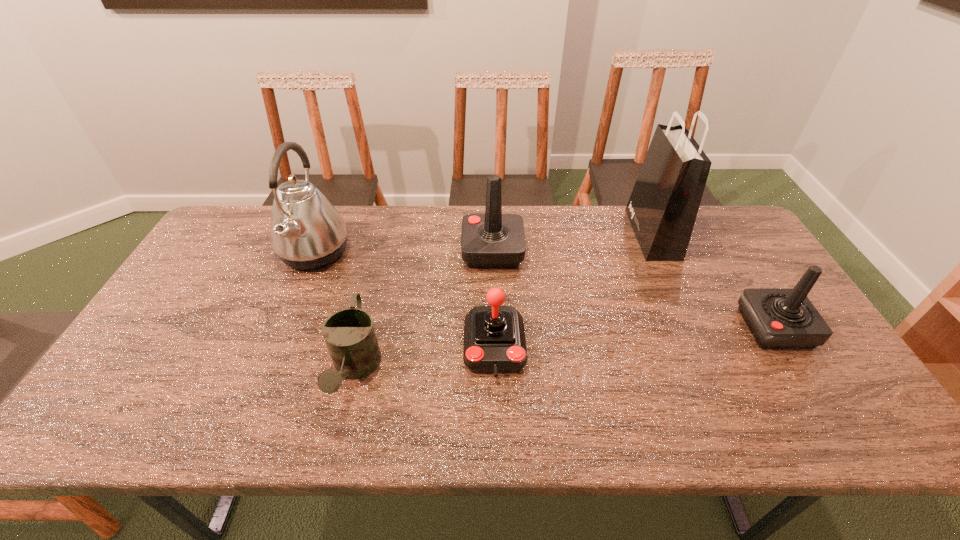
This screenshot has width=960, height=540. Find the location of `free space in the image that satisfies the following two spatial constraints: 1. on the front-facing side of the rightmost object; 2. with the spout on the fifth object from right to left`. free space in the image that satisfies the following two spatial constraints: 1. on the front-facing side of the rightmost object; 2. with the spout on the fifth object from right to left is located at coordinates (801, 370).